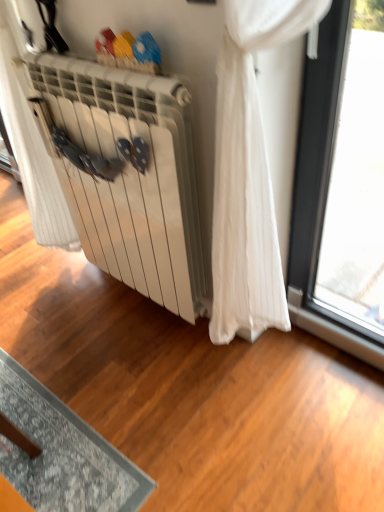
Question: Can you confirm if white sheer curtain at center is thinner than white matte radiator at center?

Choices:
 (A) yes
 (B) no

Answer: (B)

Question: Can you confirm if white sheer curtain at center is wider than white matte radiator at center?

Choices:
 (A) yes
 (B) no

Answer: (A)

Question: From the image's perspective, is white sheer curtain at center on white matte radiator at center?

Choices:
 (A) yes
 (B) no

Answer: (A)

Question: Does white sheer curtain at center have a larger size compared to white matte radiator at center?

Choices:
 (A) no
 (B) yes

Answer: (B)

Question: Is white matte radiator at center at the back of white sheer curtain at center?

Choices:
 (A) yes
 (B) no

Answer: (B)

Question: Considering the relative sizes of white sheer curtain at center and white matte radiator at center in the image provided, is white sheer curtain at center taller than white matte radiator at center?

Choices:
 (A) no
 (B) yes

Answer: (B)

Question: Can you confirm if white matte radiator at center is bigger than white sheer curtain at center?

Choices:
 (A) no
 (B) yes

Answer: (A)

Question: Can you confirm if white matte radiator at center is smaller than white sheer curtain at center?

Choices:
 (A) no
 (B) yes

Answer: (B)

Question: Would you say white matte radiator at center contains white sheer curtain at center?

Choices:
 (A) no
 (B) yes

Answer: (A)

Question: Is white matte radiator at center further to the viewer compared to white sheer curtain at center?

Choices:
 (A) no
 (B) yes

Answer: (A)

Question: From a real-world perspective, is white matte radiator at center physically below white sheer curtain at center?

Choices:
 (A) no
 (B) yes

Answer: (B)

Question: Does white matte radiator at center appear on the left side of white sheer curtain at center?

Choices:
 (A) yes
 (B) no

Answer: (B)

Question: From the image's perspective, is white sheer curtain at center positioned above or below white matte radiator at center?

Choices:
 (A) above
 (B) below

Answer: (A)